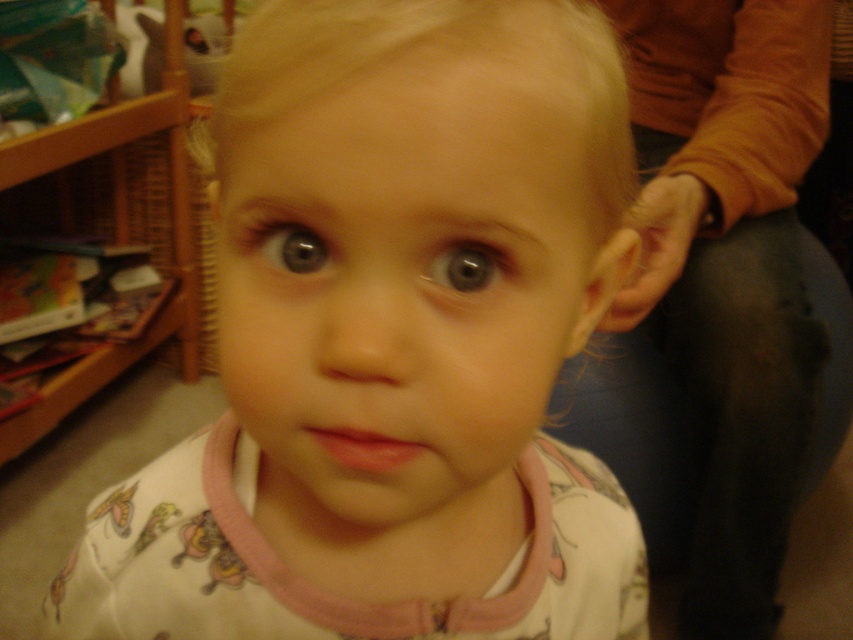
Is white cotton shirt at center shorter than smooth skin face at center?

In fact, white cotton shirt at center may be taller than smooth skin face at center.

Is white cotton shirt at center wider than smooth skin face at center?

Yes, white cotton shirt at center is wider than smooth skin face at center.

Describe the element at coordinates (392, 342) in the screenshot. I see `white cotton shirt at center` at that location.

Locate an element on the screen. This screenshot has width=853, height=640. white cotton shirt at center is located at coordinates (392, 342).

Does point (421, 632) lie behind point (750, 296)?

No, (421, 632) is in front of (750, 296).

Which is below, white cotton shirt at center or soft pink pajamas at center?

white cotton shirt at center is lower down.

Is point (347, 547) behind point (683, 608)?

No, it is in front of (683, 608).

This screenshot has height=640, width=853. I want to click on white cotton shirt at center, so click(x=392, y=342).

What are the coordinates of `white cotton shirt at center` in the screenshot? It's located at (392, 342).

Who is more distant from viewer, (302,621) or (120,160)?

The point (120,160) is more distant.

Which is behind, point (599, 516) or point (154, 113)?

Point (154, 113)

Locate an element on the screen. Image resolution: width=853 pixels, height=640 pixels. white cotton shirt at center is located at coordinates (392, 342).